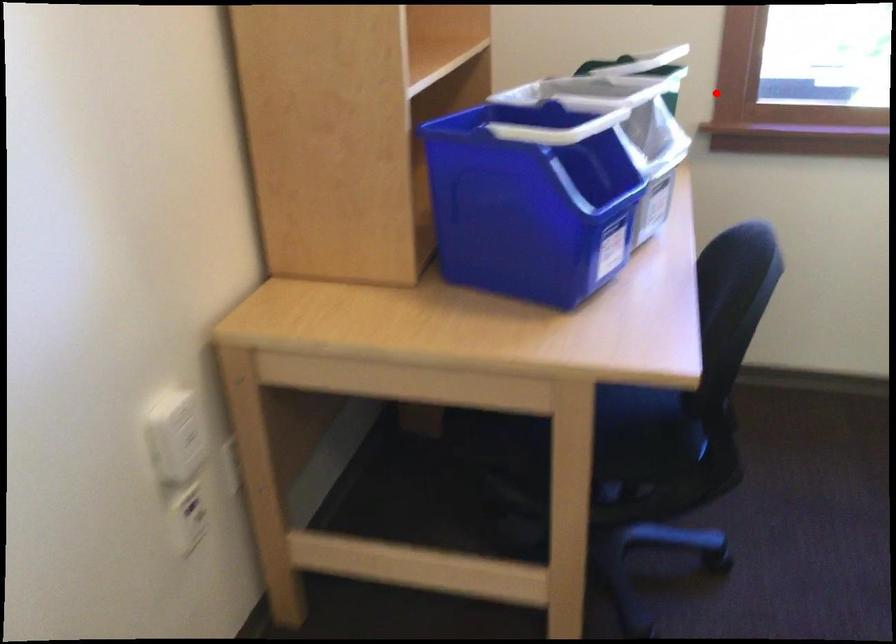
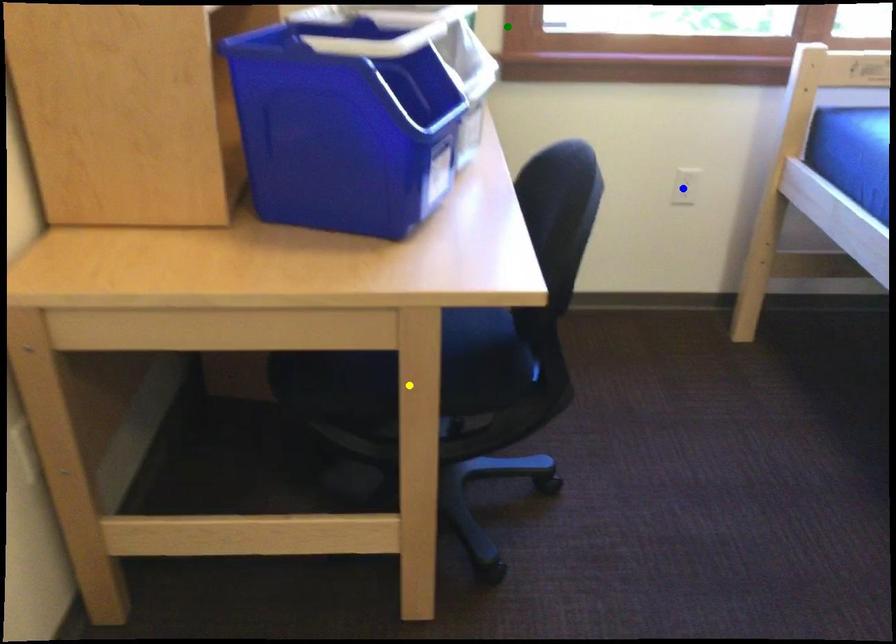
Question: I am providing you with two images of the same scene from different viewpoints. A red point is marked on the first image. You are given multiple points on the second image. Which point in image 2 is actually the same real-world point as the red point in image 1?

Choices:
 (A) green point
 (B) yellow point
 (C) blue point

Answer: (A)